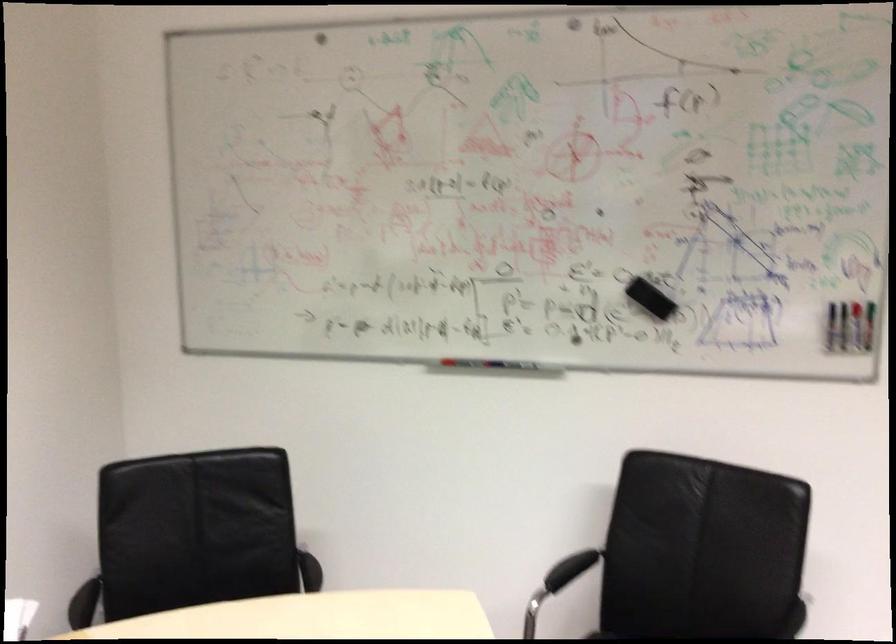
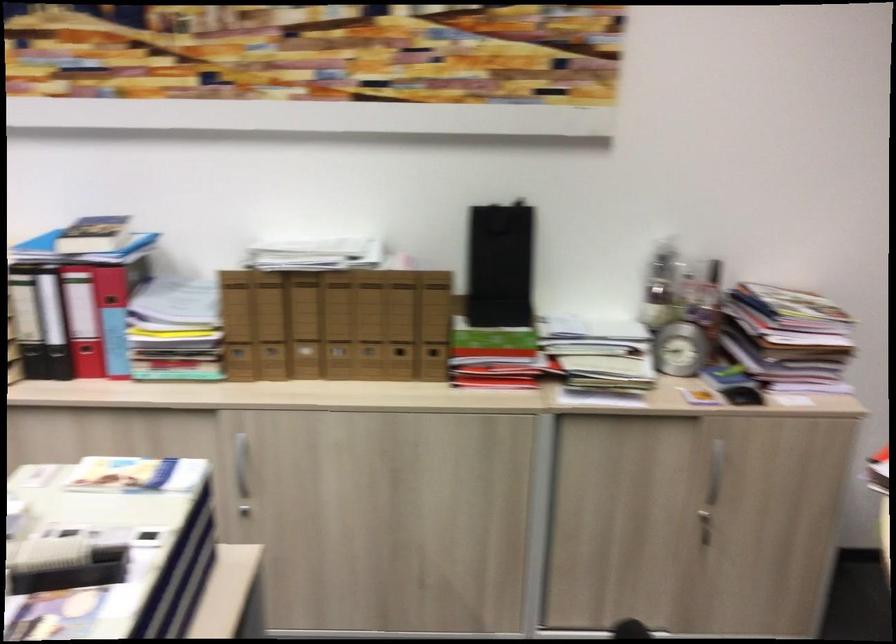
Consider the image. The first image is from the beginning of the video and the second image is from the end. How did the camera likely rotate when shooting the video?

The camera's rotation is toward left-down.